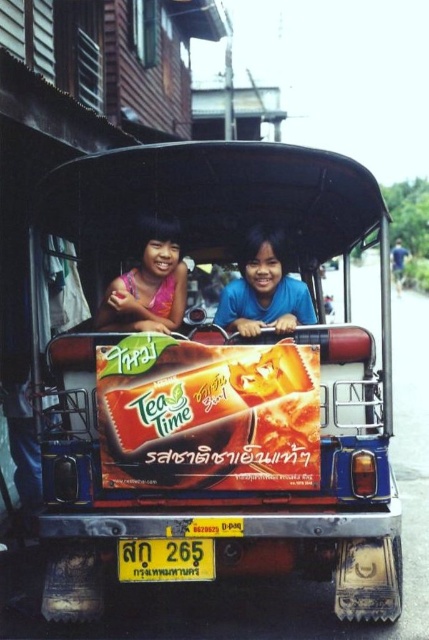
You are a photographer taking a picture of the two children in the tuk tuk. You want to focus on the matte plastic tea bag at center and the blue fabric shirt at center. Which object is located to the left of the other?

The matte plastic tea bag at center is positioned on the left side of blue fabric shirt at center.

You are a delivery person needing to place a matte plastic tea bag at center and a blue fabric coach at right into a storage box. The box can only hold items within 10 meters of each other. Can both items fit in the box?

The matte plastic tea bag at center is 10.15 meters away from blue fabric coach at right, which exceeds the 10 meters limit. Therefore, both items cannot fit into the storage box.